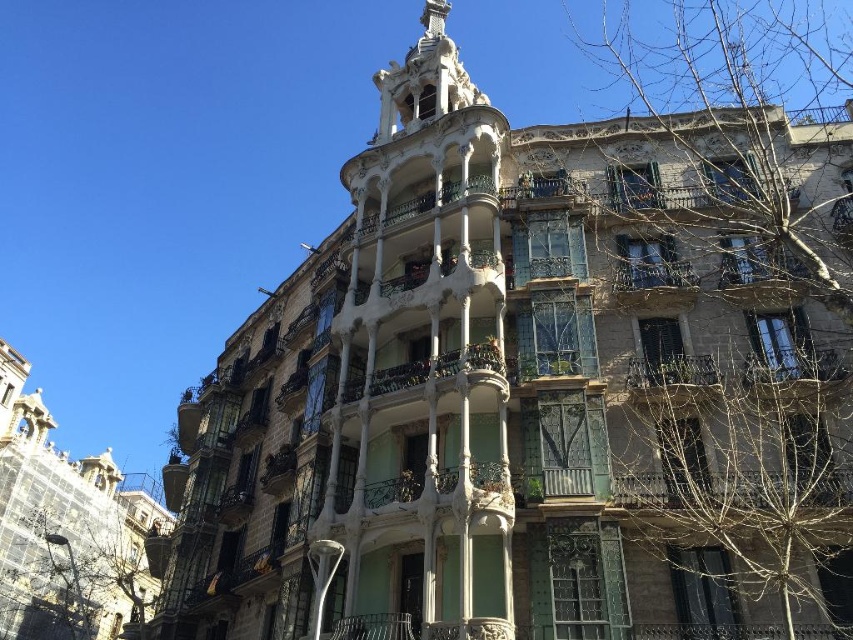
Between point (640, 376) and point (643, 276), which one is positioned in front?

Point (640, 376) is more forward.

Does rustic wrought iron balcony at center right appear on the right side of rustic wrought iron balcony at center?

Correct, you'll find rustic wrought iron balcony at center right to the right of rustic wrought iron balcony at center.

Find the location of a particular element. rustic wrought iron balcony at center right is located at coordinates (671, 378).

Identify the location of rustic wrought iron balcony at center right. The width and height of the screenshot is (853, 640). (671, 378).

What do you see at coordinates (671, 378) in the screenshot? I see `rustic wrought iron balcony at center right` at bounding box center [671, 378].

Does rustic wrought iron balcony at center right have a lesser width compared to green wrought iron balcony at center?

Correct, rustic wrought iron balcony at center right's width is less than green wrought iron balcony at center's.

Find the location of a particular element. The image size is (853, 640). rustic wrought iron balcony at center right is located at coordinates (671, 378).

Where is `rustic wrought iron balcony at center right`? This screenshot has height=640, width=853. rustic wrought iron balcony at center right is located at coordinates (671, 378).

Is green wrought iron balcony at upper center taller than rustic wrought iron balcony at center?

Yes.

Between point (763, 248) and point (664, 304), which one is positioned in front?

Point (664, 304) is more forward.

Identify the location of green wrought iron balcony at upper center. (757, 273).